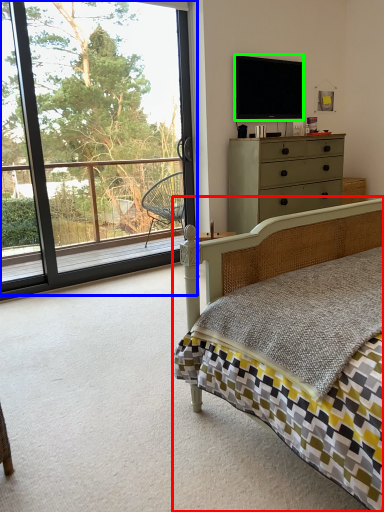
Question: Which object is the farthest from bed (highlighted by a red box)? Choose among these: window (highlighted by a blue box) or television (highlighted by a green box).

Choices:
 (A) window
 (B) television

Answer: (A)